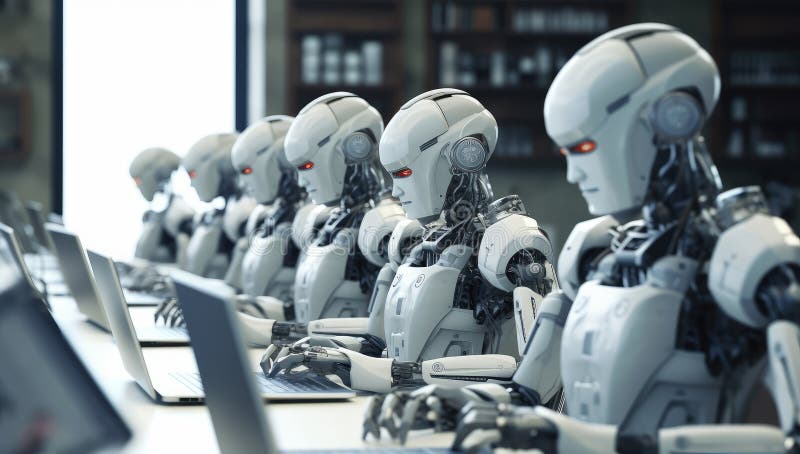
This screenshot has height=454, width=800. In order to click on laptop in this screenshot , I will do `click(230, 404)`, `click(149, 376)`, `click(68, 257)`, `click(16, 257)`, `click(52, 215)`, `click(32, 215)`, `click(9, 210)`, `click(14, 195)`.